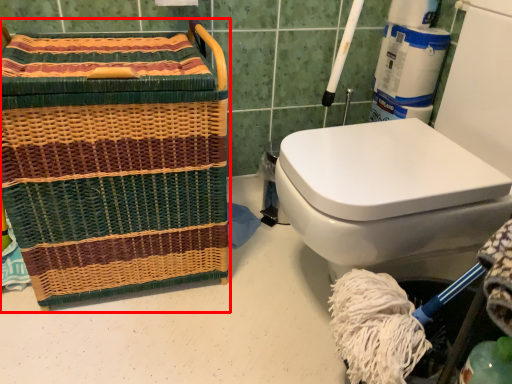
Question: Where is basket (annotated by the red box) located in relation to teal in the image?

Choices:
 (A) left
 (B) right

Answer: (A)